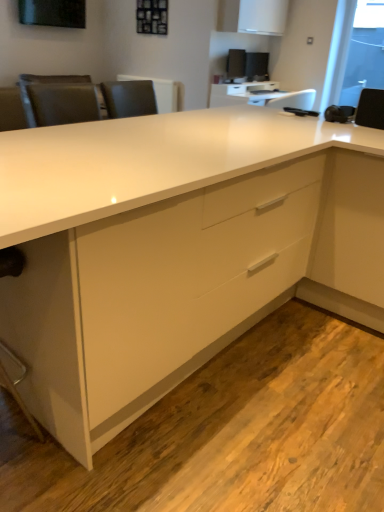
Question: Considering the relative sizes of satin black monitor at upper center, positioned as the first computer monitor in left-to-right order, and transparent glass window screen at upper right in the image provided, is satin black monitor at upper center, positioned as the first computer monitor in left-to-right order, thinner than transparent glass window screen at upper right?

Choices:
 (A) yes
 (B) no

Answer: (B)

Question: Is satin black monitor at upper center, which is counted as the 2th computer monitor, starting from the right, at the right side of transparent glass window screen at upper right?

Choices:
 (A) no
 (B) yes

Answer: (A)

Question: Is transparent glass window screen at upper right surrounded by satin black monitor at upper center, which is counted as the 2th computer monitor, starting from the right?

Choices:
 (A) yes
 (B) no

Answer: (B)

Question: Is satin black monitor at upper center, positioned as the first computer monitor in left-to-right order, not near transparent glass window screen at upper right?

Choices:
 (A) no
 (B) yes

Answer: (B)

Question: Does satin black monitor at upper center, which is counted as the 2th computer monitor, starting from the right, touch transparent glass window screen at upper right?

Choices:
 (A) no
 (B) yes

Answer: (A)

Question: From a real-world perspective, is white glossy desk at center physically located above or below satin black monitor at upper center, which is counted as the 2th computer monitor, starting from the right?

Choices:
 (A) below
 (B) above

Answer: (A)

Question: Is white glossy desk at center inside or outside of satin black monitor at upper center, positioned as the first computer monitor in left-to-right order?

Choices:
 (A) outside
 (B) inside

Answer: (A)

Question: Is white glossy desk at center taller or shorter than satin black monitor at upper center, which is counted as the 2th computer monitor, starting from the right?

Choices:
 (A) short
 (B) tall

Answer: (B)

Question: Considering the positions of point (269, 121) and point (233, 74), is point (269, 121) closer or farther from the camera than point (233, 74)?

Choices:
 (A) closer
 (B) farther

Answer: (A)

Question: Would you say white matte cabinet at upper center is to the left or to the right of transparent glass window screen at upper right in the picture?

Choices:
 (A) right
 (B) left

Answer: (B)

Question: Looking at the image, does white matte cabinet at upper center seem bigger or smaller compared to transparent glass window screen at upper right?

Choices:
 (A) small
 (B) big

Answer: (B)

Question: From their relative heights in the image, would you say white matte cabinet at upper center is taller or shorter than transparent glass window screen at upper right?

Choices:
 (A) short
 (B) tall

Answer: (A)

Question: Considering their positions, is white matte cabinet at upper center located in front of or behind transparent glass window screen at upper right?

Choices:
 (A) behind
 (B) front

Answer: (B)

Question: Is white glossy table at upper center to the left or to the right of satin black monitor at upper center, the 1th computer monitor in the right-to-left sequence, in the image?

Choices:
 (A) left
 (B) right

Answer: (A)

Question: Relative to satin black monitor at upper center, the 1th computer monitor in the right-to-left sequence, is white glossy table at upper center in front or behind?

Choices:
 (A) behind
 (B) front

Answer: (B)